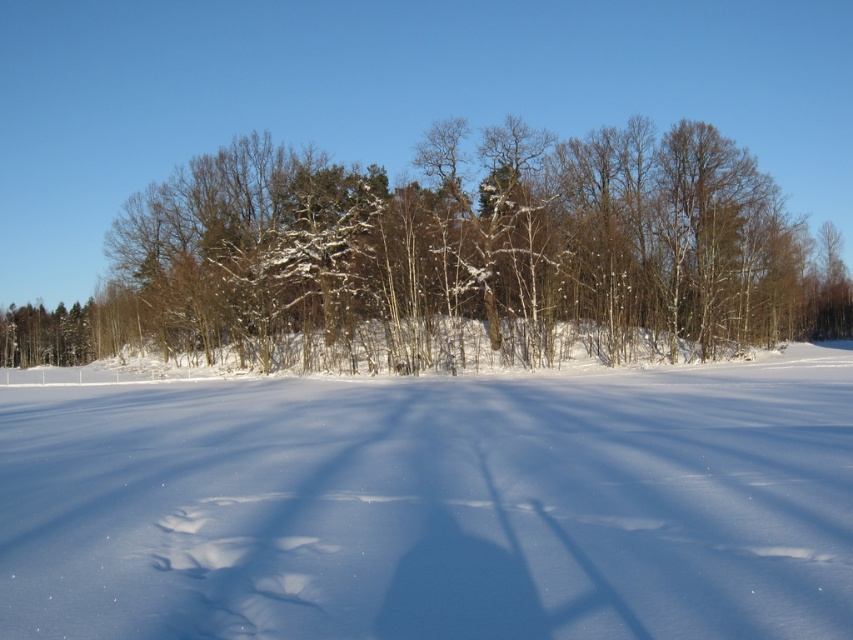
Question: Which object is farther from the camera taking this photo?

Choices:
 (A) snow-covered trees at center
 (B) white powdery snow at center

Answer: (A)

Question: Can you confirm if white powdery snow at center is positioned to the right of snow-covered trees at center?

Choices:
 (A) yes
 (B) no

Answer: (A)

Question: Considering the relative positions of white powdery snow at center and snow-covered trees at center in the image provided, where is white powdery snow at center located with respect to snow-covered trees at center?

Choices:
 (A) below
 (B) above

Answer: (A)

Question: Does white powdery snow at center have a smaller size compared to snow-covered trees at center?

Choices:
 (A) yes
 (B) no

Answer: (A)

Question: Which object appears farthest from the camera in this image?

Choices:
 (A) white powdery snow at center
 (B) snow-covered trees at center

Answer: (B)